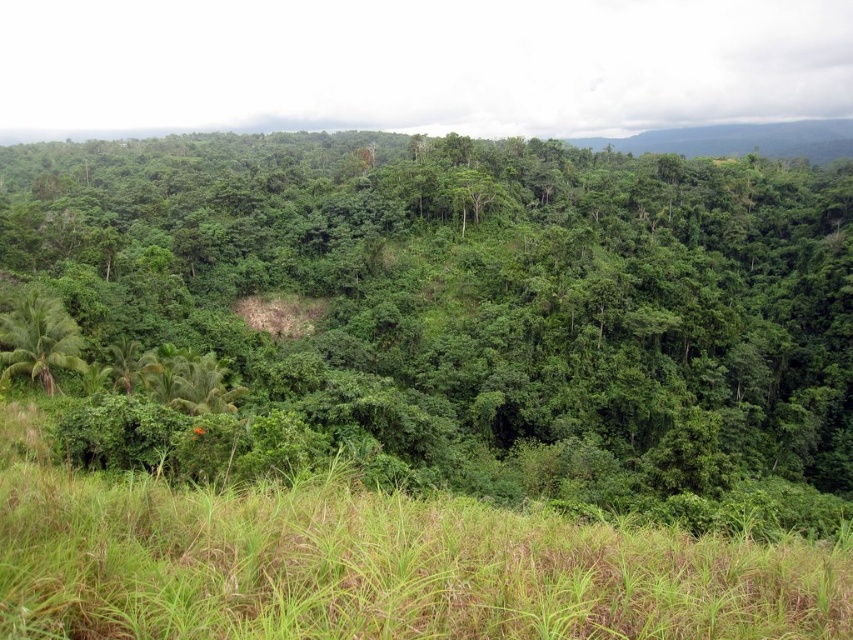
You are a hiker trying to navigate through the tropical forest. You see the green grassy field at lower center and the green leafy palm tree at lower left. Which direction should you head towards to move from the palm tree to the grassy field?

To move from the green leafy palm tree at lower left to the green grassy field at lower center, you should head towards the right since the green grassy field at lower center is located to the right of the green leafy palm tree at lower left.

You are standing at the point point [476,292] in the tropical forest. What is the nearest object to you?

The nearest object to you at point [476,292] is the green leafy tree at center, as the point represents its location.

You are planning to plant a new tree in the green grassy field at lower center. Considering the size of the existing green leafy tree at center, will there be enough space for the new tree to grow without overcrowding?

The green leafy tree at center is larger in size than the green grassy field at lower center, so there may not be sufficient space for the new tree to grow without overcrowding.